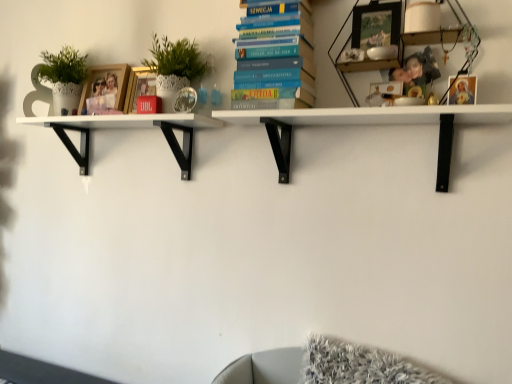
The width and height of the screenshot is (512, 384). What do you see at coordinates (275, 57) in the screenshot? I see `blue hardcover book at center` at bounding box center [275, 57].

Find the location of `blue hardcover book at center`. blue hardcover book at center is located at coordinates (275, 57).

Describe the element at coordinates (462, 90) in the screenshot. The image size is (512, 384). I see `matte gold picture frame at upper right, which is the 4th picture frame in back-to-front order` at that location.

This screenshot has width=512, height=384. Describe the element at coordinates (368, 124) in the screenshot. I see `white matte shelf at center, the 2th shelf when ordered from left to right` at that location.

Find the location of a particular element. gold metallic picture frame at upper center, which ranks as the 2th picture frame in left-to-right order is located at coordinates (139, 87).

Describe the element at coordinates (339, 56) in the screenshot. This screenshot has width=512, height=384. I see `wooden photo frame at upper right, which is counted as the 3th shelf, starting from the left` at that location.

The image size is (512, 384). In order to click on blue hardcover book at center in this screenshot , I will do `click(275, 57)`.

Which object is positioned more to the left, white matte shelf at center, the 2th shelf when ordered from left to right, or wooden photo frame at upper right, positioned as the first shelf in right-to-left order?

white matte shelf at center, the 2th shelf when ordered from left to right.

Which shelf is the 1st one when counting from the left side of the wooden photo frame at upper right, positioned as the first shelf in right-to-left order? Please provide its 2D coordinates.

[(368, 124)]

Looking at this image, from the image's perspective, which one is positioned lower, white matte shelf at center, the 2th shelf when ordered from left to right, or wooden photo frame at upper right, positioned as the first shelf in right-to-left order?

From the image's view, white matte shelf at center, the 2th shelf when ordered from left to right, is below.

From a real-world perspective, which picture frame is the 3rd one above the white matte shelf at center, the second shelf when ordered from right to left? Please provide its 2D coordinates.

[(105, 90)]

Does point (452, 118) come in front of point (82, 113)?

Yes, it is in front of point (82, 113).

Visually, is white matte shelf at center, the 2th shelf when ordered from left to right, positioned to the left or to the right of wooden photo frame at upper left, which ranks as the fourth picture frame in right-to-left order?

In the image, white matte shelf at center, the 2th shelf when ordered from left to right, appears on the right side of wooden photo frame at upper left, which ranks as the fourth picture frame in right-to-left order.

Between white matte shelf at center, the second shelf when ordered from right to left, and wooden photo frame at upper left, the 4th picture frame when ordered from front to back, which one has less height?

white matte shelf at center, the second shelf when ordered from right to left.

Is blue hardcover book at center completely or partially outside of white matte shelf at left, which ranks as the first shelf in left-to-right order?

Yes, blue hardcover book at center is outside of white matte shelf at left, which ranks as the first shelf in left-to-right order.

Is blue hardcover book at center positioned far away from white matte shelf at left, arranged as the third shelf when viewed from the right?

No, blue hardcover book at center is not far from white matte shelf at left, arranged as the third shelf when viewed from the right.

Locate an element on the screen. This screenshot has height=384, width=512. shelf behind the blue hardcover book at center is located at coordinates (128, 127).

Is blue hardcover book at center thinner than white matte shelf at left, arranged as the third shelf when viewed from the right?

Yes.

Are white matte shelf at left, arranged as the third shelf when viewed from the right, and wooden photo frame at upper right, positioned as the first shelf in right-to-left order, located far from each other?

That's not correct — white matte shelf at left, arranged as the third shelf when viewed from the right, is a little close to wooden photo frame at upper right, positioned as the first shelf in right-to-left order.

Does white matte shelf at left, which ranks as the first shelf in left-to-right order, come in front of wooden photo frame at upper right, which is counted as the 3th shelf, starting from the left?

No, it is behind wooden photo frame at upper right, which is counted as the 3th shelf, starting from the left.

Looking at this image, between white matte shelf at left, arranged as the third shelf when viewed from the right, and wooden photo frame at upper right, which is counted as the 3th shelf, starting from the left, which one has more height?

With more height is wooden photo frame at upper right, which is counted as the 3th shelf, starting from the left.

In the scene shown: Which is farther from the camera, [188,149] or [147,67]?

The point [147,67] is behind.

Considering the sizes of white matte shelf at left, which ranks as the first shelf in left-to-right order, and gold metallic picture frame at upper center, which ranks as the third picture frame in front-to-back order, in the image, is white matte shelf at left, which ranks as the first shelf in left-to-right order, bigger or smaller than gold metallic picture frame at upper center, which ranks as the third picture frame in front-to-back order,?

Clearly, white matte shelf at left, which ranks as the first shelf in left-to-right order, is larger in size than gold metallic picture frame at upper center, which ranks as the third picture frame in front-to-back order.

Is white matte shelf at left, arranged as the third shelf when viewed from the right, outside of gold metallic picture frame at upper center, which ranks as the third picture frame in front-to-back order?

Yes.

Is white matte shelf at left, arranged as the third shelf when viewed from the right, taller than gold metallic picture frame at upper center, which is counted as the second picture frame, starting from the back?

Incorrect, the height of white matte shelf at left, arranged as the third shelf when viewed from the right, is not larger of that of gold metallic picture frame at upper center, which is counted as the second picture frame, starting from the back.

What are the coordinates of `the 3rd picture frame above the white matte shelf at left, which ranks as the first shelf in left-to-right order (from a real-world perspective)` in the screenshot? It's located at (105, 90).

Can you tell me how much white matte shelf at left, which ranks as the first shelf in left-to-right order, and wooden photo frame at upper left, arranged as the 1th picture frame when viewed from the back, differ in facing direction?

They differ by 1.07 degrees in their facing directions.

Considering the relative positions of white matte shelf at left, which ranks as the first shelf in left-to-right order, and wooden photo frame at upper left, the 4th picture frame when ordered from front to back, in the image provided, is white matte shelf at left, which ranks as the first shelf in left-to-right order, to the left of wooden photo frame at upper left, the 4th picture frame when ordered from front to back, from the viewer's perspective?

No, white matte shelf at left, which ranks as the first shelf in left-to-right order, is not to the left of wooden photo frame at upper left, the 4th picture frame when ordered from front to back.

Can you confirm if white matte shelf at left, which ranks as the first shelf in left-to-right order, is shorter than wooden photo frame at upper left, the 4th picture frame when ordered from front to back?

No, white matte shelf at left, which ranks as the first shelf in left-to-right order, is not shorter than wooden photo frame at upper left, the 4th picture frame when ordered from front to back.

How many degrees apart are the facing directions of blue hardcover book at center and gold metallic picture frame at upper center, which is counted as the second picture frame, starting from the back?

They differ by 2.07 degrees in their facing directions.

Is blue hardcover book at center positioned far away from gold metallic picture frame at upper center, which ranks as the 2th picture frame in left-to-right order?

No, blue hardcover book at center is in close proximity to gold metallic picture frame at upper center, which ranks as the 2th picture frame in left-to-right order.

Considering the relative sizes of blue hardcover book at center and gold metallic picture frame at upper center, which is counted as the second picture frame, starting from the back, in the image provided, is blue hardcover book at center wider than gold metallic picture frame at upper center, which is counted as the second picture frame, starting from the back,?

Yes.

Considering the positions of points (303, 83) and (138, 76), is point (303, 83) farther from camera compared to point (138, 76)?

That is False.

Locate an element on the screen. the 1st shelf behind when counting from the white matte shelf at center, the second shelf when ordered from right to left is located at coordinates (339, 56).

Locate an element on the screen. The image size is (512, 384). shelf that is the 2nd object located below the wooden photo frame at upper left, which ranks as the fourth picture frame in right-to-left order (from the image's perspective) is located at coordinates (368, 124).

When comparing their distances from wooden photo frame at upper right, which is counted as the 3th shelf, starting from the left, does gold metallic picture frame at upper center, which ranks as the 2th picture frame in left-to-right order, or white matte shelf at left, which ranks as the first shelf in left-to-right order, seem further?

white matte shelf at left, which ranks as the first shelf in left-to-right order, is positioned further to the anchor wooden photo frame at upper right, which is counted as the 3th shelf, starting from the left.

In the scene shown: Based on their spatial positions, is white matte shelf at center, the 2th shelf when ordered from left to right, or matte gold picture frame at upper right, the 4th picture frame in the left-to-right sequence, further from wooden photo frame at upper right, positioned as the first shelf in right-to-left order?

white matte shelf at center, the 2th shelf when ordered from left to right, lies further to wooden photo frame at upper right, positioned as the first shelf in right-to-left order, than the other object.

Considering their positions, is white matte shelf at center, the second shelf when ordered from right to left, positioned closer to matte gold picture frame at upper right, which is the 4th picture frame in back-to-front order, than metallic silver picture frame at upper right, the 3th picture frame when ordered from back to front?

white matte shelf at center, the second shelf when ordered from right to left, is positioned closer to the anchor matte gold picture frame at upper right, which is the 4th picture frame in back-to-front order.

Based on their spatial positions, is blue hardcover book at center or white matte shelf at left, arranged as the third shelf when viewed from the right, further from wooden photo frame at upper right, positioned as the first shelf in right-to-left order?

white matte shelf at left, arranged as the third shelf when viewed from the right.

Based on their spatial positions, is matte gold picture frame at upper right, the 1th picture frame positioned from the front, or metallic silver picture frame at upper right, the second picture frame positioned from the right, further from white matte shelf at center, the 2th shelf when ordered from left to right?

metallic silver picture frame at upper right, the second picture frame positioned from the right, is positioned further to the anchor white matte shelf at center, the 2th shelf when ordered from left to right.

Considering their positions, is matte gold picture frame at upper right, the 4th picture frame in the left-to-right sequence, positioned closer to metallic silver picture frame at upper right, the second picture frame in the front-to-back sequence, than wooden photo frame at upper left, arranged as the 1th picture frame when viewed from the back?

The object closer to metallic silver picture frame at upper right, the second picture frame in the front-to-back sequence, is matte gold picture frame at upper right, the 4th picture frame in the left-to-right sequence.

Estimate the real-world distances between objects in this image. Which object is closer to blue hardcover book at center, metallic silver picture frame at upper right, the second picture frame in the front-to-back sequence, or white matte shelf at center, the second shelf when ordered from right to left?

white matte shelf at center, the second shelf when ordered from right to left, is positioned closer to the anchor blue hardcover book at center.

In the scene shown: Looking at the image, which one is located closer to white matte shelf at left, arranged as the third shelf when viewed from the right, white matte shelf at center, the second shelf when ordered from right to left, or wooden photo frame at upper right, which is counted as the 3th shelf, starting from the left?

Based on the image, white matte shelf at center, the second shelf when ordered from right to left, appears to be nearer to white matte shelf at left, arranged as the third shelf when viewed from the right.

The height and width of the screenshot is (384, 512). I want to click on book between wooden photo frame at upper left, the 4th picture frame when ordered from front to back, and white matte shelf at center, the second shelf when ordered from right to left, so click(x=275, y=57).

Identify the location of picture frame between wooden photo frame at upper left, which is counted as the first picture frame, starting from the left, and white matte shelf at center, the second shelf when ordered from right to left, in the horizontal direction. (139, 87).

At what (x,y) coordinates should I click in order to perform the action: click on book situated between gold metallic picture frame at upper center, which ranks as the third picture frame in front-to-back order, and wooden photo frame at upper right, which is counted as the 3th shelf, starting from the left, from left to right. Please return your answer as a coordinate pair (x, y). Looking at the image, I should click on (275, 57).

What are the coordinates of `shelf between gold metallic picture frame at upper center, the third picture frame positioned from the right, and wooden photo frame at upper right, which is counted as the 3th shelf, starting from the left, in the horizontal direction` in the screenshot? It's located at (368, 124).